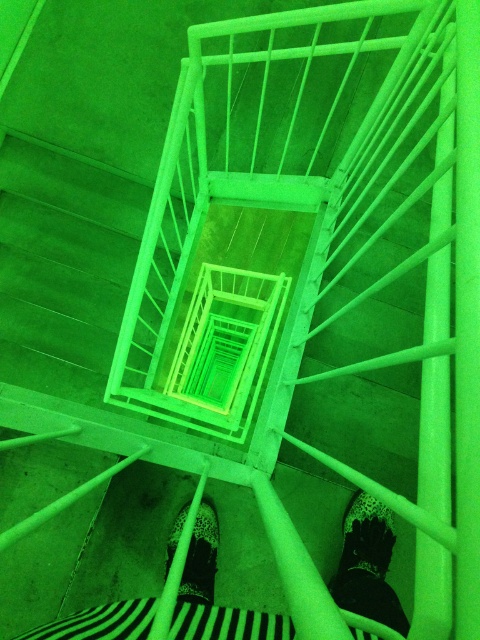
Question: Can you confirm if striped fabric pants at center is smaller than black matte/leather shoe at lower center?

Choices:
 (A) yes
 (B) no

Answer: (B)

Question: Where is black matte/leather shoe at lower center located in relation to leopard print shoe at center in the image?

Choices:
 (A) above
 (B) below

Answer: (A)

Question: Estimate the real-world distances between objects in this image. Which object is closer to the leopard print shoe at center?

Choices:
 (A) striped fabric pants at center
 (B) black matte/leather shoe at lower center

Answer: (A)

Question: From the image, what is the correct spatial relationship of striped fabric pants at center in relation to black matte/leather shoe at lower center?

Choices:
 (A) right
 (B) left

Answer: (B)

Question: Which object appears closest to the camera in this image?

Choices:
 (A) leopard print shoe at center
 (B) black matte/leather shoe at lower center
 (C) striped fabric pants at center

Answer: (C)

Question: Considering the real-world distances, which object is farthest from the black matte/leather shoe at lower center?

Choices:
 (A) leopard print shoe at center
 (B) striped fabric pants at center

Answer: (A)